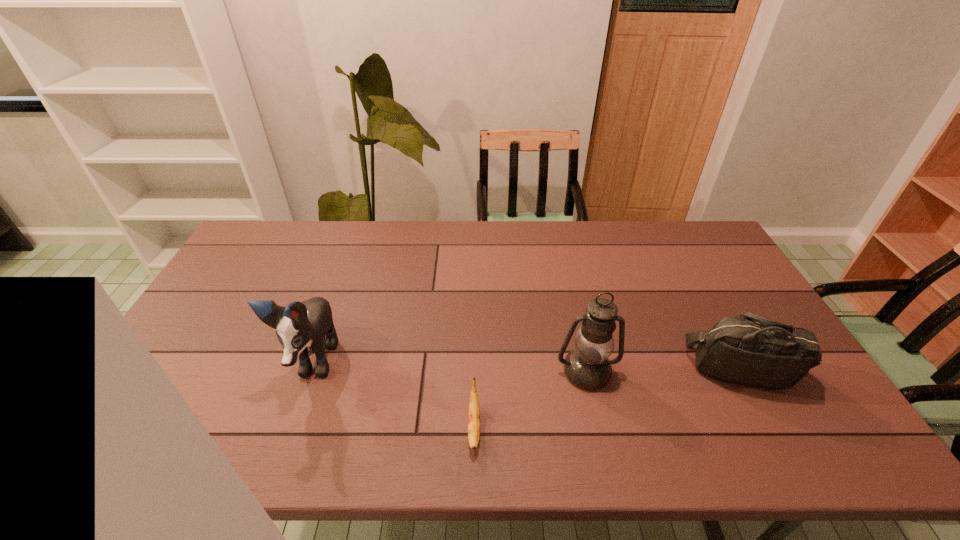
You are a GUI agent. You are given a task and a screenshot of the screen. Output one action in this format:
    pyautogui.click(x=<x>, y=<y>)
    Task: Click on the object at the right edge
    The height and width of the screenshot is (540, 960).
    Given the screenshot: What is the action you would take?
    pyautogui.click(x=751, y=350)

You are a GUI agent. You are given a task and a screenshot of the screen. Output one action in this format:
    pyautogui.click(x=<x>, y=<y>)
    Task: Click on the free point at the far edge
    The height and width of the screenshot is (540, 960).
    Given the screenshot: What is the action you would take?
    pyautogui.click(x=481, y=226)

Where is `vacant space at the near edge of the desktop`? The image size is (960, 540). vacant space at the near edge of the desktop is located at coordinates (440, 440).

Where is `vacant area at the right edge of the desktop`? The width and height of the screenshot is (960, 540). vacant area at the right edge of the desktop is located at coordinates (789, 408).

The image size is (960, 540). What are the coordinates of `vacant space at the far left corner` in the screenshot? It's located at (253, 233).

In order to click on blank space at the near right corner of the desktop in this screenshot , I will do `click(830, 427)`.

Locate an element on the screen. The image size is (960, 540). empty space between the oil lamp and the puppy is located at coordinates (449, 367).

The image size is (960, 540). Find the location of `free area in between the third object from left to right and the leftmost object`. free area in between the third object from left to right and the leftmost object is located at coordinates (449, 367).

Identify the location of empty space between the puppy and the second object from right to left. (449, 367).

This screenshot has width=960, height=540. What are the coordinates of `vacant space that's between the leftmost object and the rightmost object` in the screenshot? It's located at (527, 366).